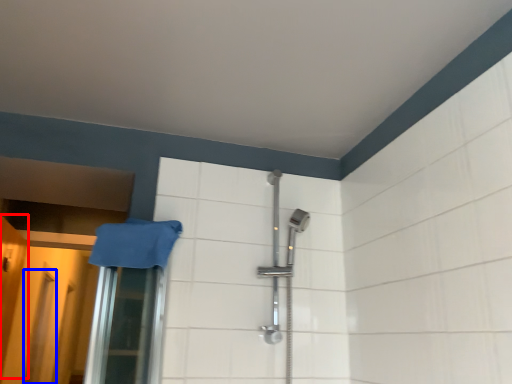
Question: Which object is further to the camera taking this photo, door (highlighted by a red box) or screen door (highlighted by a blue box)?

Choices:
 (A) door
 (B) screen door

Answer: (B)